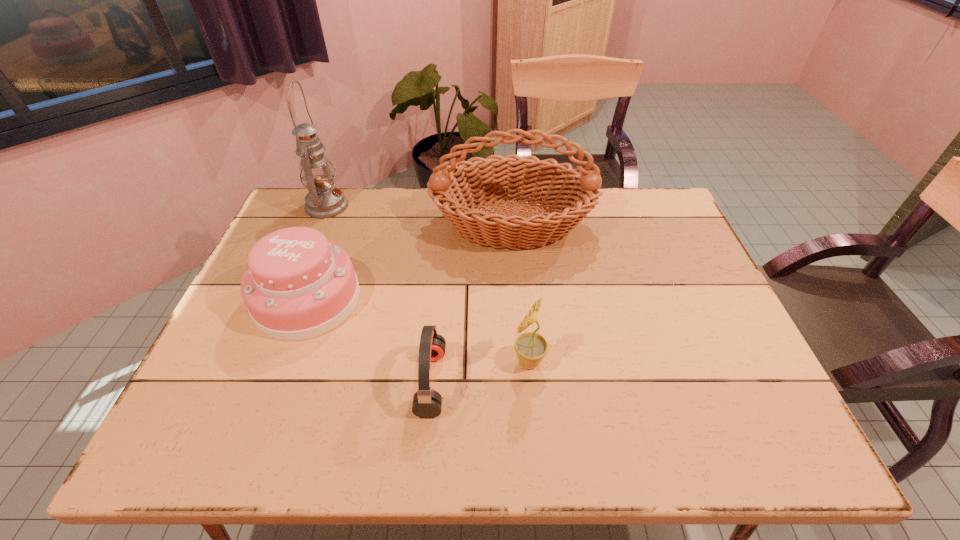
At what (x,y) coordinates should I click in order to perform the action: click on vacant space at the left edge of the desktop. Please return your answer as a coordinate pair (x, y). The width and height of the screenshot is (960, 540). Looking at the image, I should click on (251, 396).

Identify the location of free space at the right edge. Image resolution: width=960 pixels, height=540 pixels. (717, 375).

The image size is (960, 540). What are the coordinates of `vacant area between the sunflower and the basket` in the screenshot? It's located at (520, 293).

Image resolution: width=960 pixels, height=540 pixels. Find the location of `vacant point located between the sunflower and the oil lamp`. vacant point located between the sunflower and the oil lamp is located at coordinates (428, 284).

Locate an element on the screen. vacant area that lies between the second tallest object and the sunflower is located at coordinates (520, 293).

The width and height of the screenshot is (960, 540). Identify the location of empty space between the shortest object and the sunflower. (480, 372).

The image size is (960, 540). In order to click on free area in between the third nearest object and the shortest object in this screenshot , I will do `click(370, 341)`.

At what (x,y) coordinates should I click in order to perform the action: click on unoccupied position between the third nearest object and the fourth shortest object. Please return your answer as a coordinate pair (x, y). The image size is (960, 540). Looking at the image, I should click on (410, 262).

The image size is (960, 540). I want to click on vacant area that lies between the oil lamp and the sunflower, so click(428, 284).

Where is `free space between the basket and the tallest object`? The height and width of the screenshot is (540, 960). free space between the basket and the tallest object is located at coordinates (420, 215).